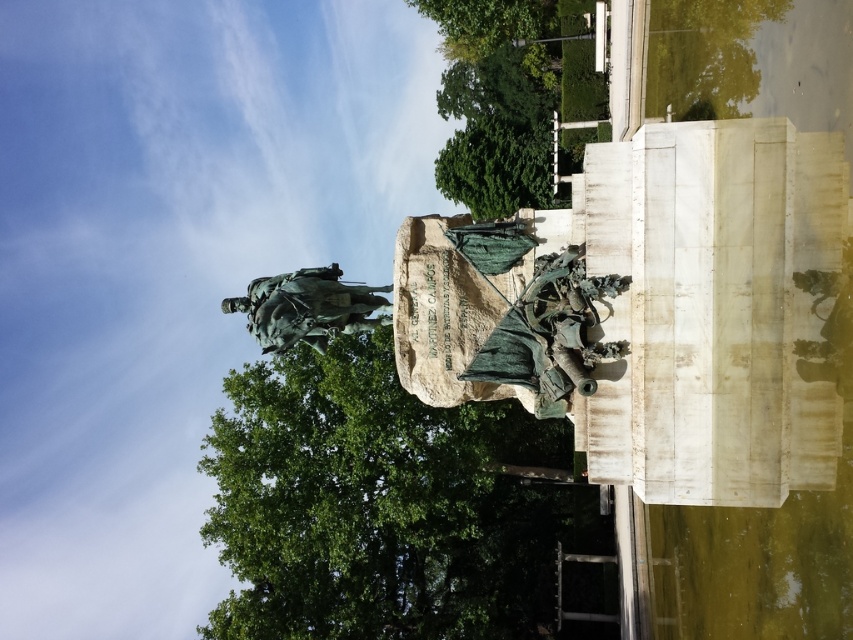
Question: In this image, where is green leafy tree at center located relative to green leafy tree at upper center?

Choices:
 (A) above
 (B) below

Answer: (B)

Question: Where is green leafy tree at center located in relation to bronze statue at center in the image?

Choices:
 (A) left
 (B) right

Answer: (A)

Question: Which of the following is the closest to the observer?

Choices:
 (A) (320, 346)
 (B) (258, 397)
 (C) (426, 13)

Answer: (A)

Question: Which is nearer to the green leafy tree at upper center?

Choices:
 (A) bronze statue at center
 (B) green leafy tree at center

Answer: (B)

Question: Can you confirm if green leafy tree at upper center is positioned above bronze statue at center?

Choices:
 (A) yes
 (B) no

Answer: (A)

Question: Which of the following is the farthest from the observer?

Choices:
 (A) green leafy tree at center
 (B) green leafy tree at upper center

Answer: (B)